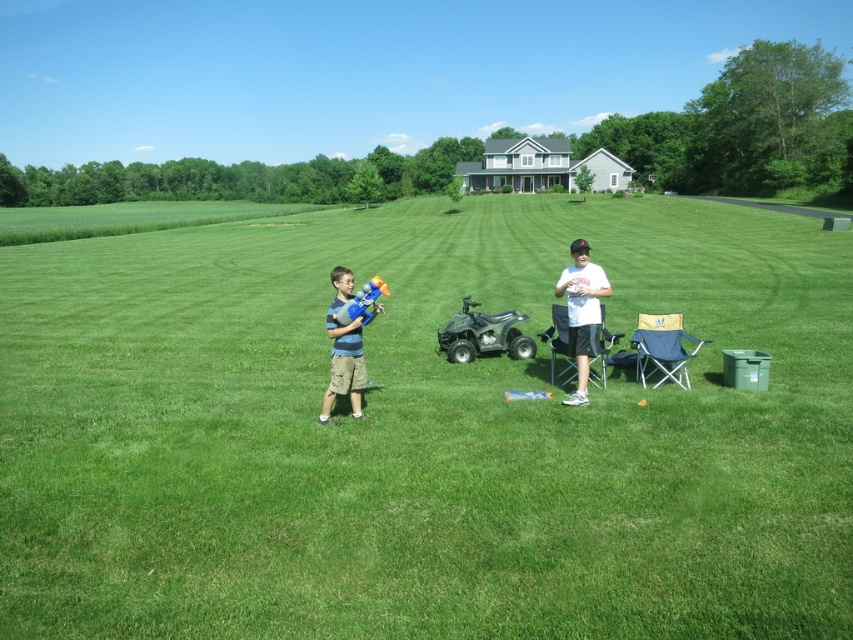
Find the location of `green grass at center`. green grass at center is located at coordinates (422, 433).

Is green grass at center closer to the viewer compared to white matte t-shirt at center?

That is True.

Is point (440, 436) positioned in front of point (596, 312)?

Yes, point (440, 436) is closer to viewer.

You are a GUI agent. You are given a task and a screenshot of the screen. Output one action in this format:
    pyautogui.click(x=<x>, y=<y>)
    Task: Click on the green grass at center
    Image resolution: width=853 pixels, height=640 pixels.
    Given the screenshot: What is the action you would take?
    pyautogui.click(x=422, y=433)